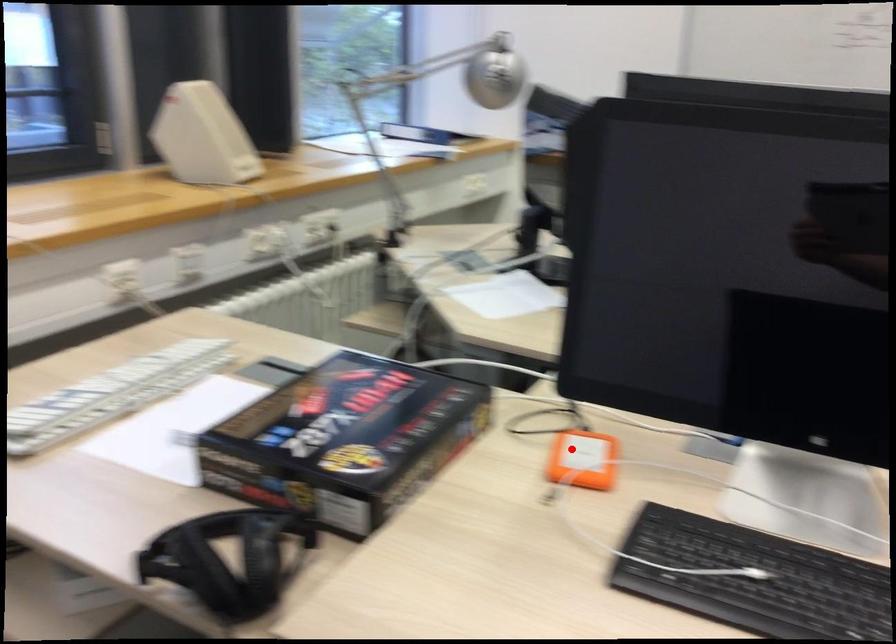
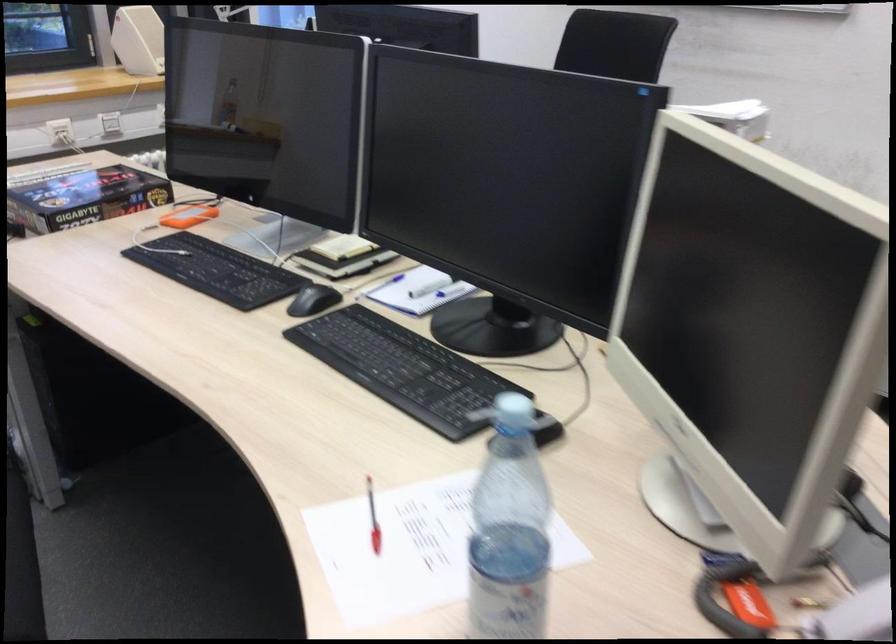
Find the pixel in the second image that matches the highlighted location in the first image.

(188, 216)